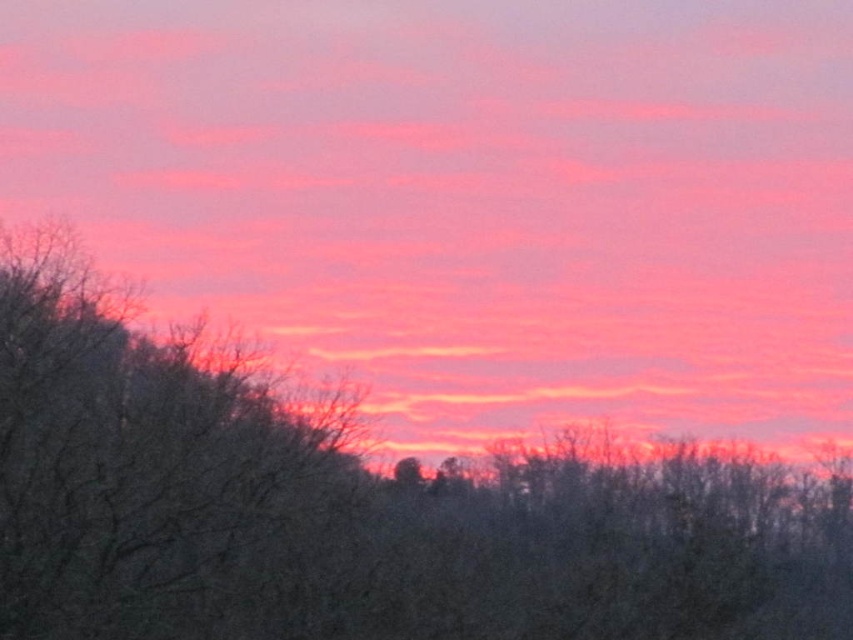
Question: Which point appears farthest from the camera in this image?

Choices:
 (A) (675, 516)
 (B) (834, 346)
 (C) (62, 566)

Answer: (B)

Question: In this image, where is pink matte cloud at upper center located relative to brown textured tree at left?

Choices:
 (A) right
 (B) left

Answer: (A)

Question: Which point is closer to the camera taking this photo?

Choices:
 (A) (321, 620)
 (B) (4, 422)
 (C) (697, 182)

Answer: (A)

Question: Does pink matte cloud at upper center come behind brown matte tree at center?

Choices:
 (A) yes
 (B) no

Answer: (A)

Question: Does brown matte tree at center appear on the left side of brown textured tree at left?

Choices:
 (A) no
 (B) yes

Answer: (A)

Question: Which point is closer to the camera?

Choices:
 (A) coord(119,412)
 (B) coord(99,385)

Answer: (A)